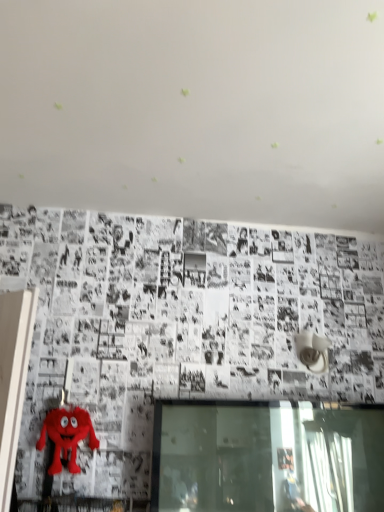
Question: Should I look upward or downward to see fuzzy red plush toy at lower left?

Choices:
 (A) down
 (B) up

Answer: (A)

Question: Does transparent glass window at lower center have a greater width compared to fuzzy red plush toy at lower left?

Choices:
 (A) yes
 (B) no

Answer: (A)

Question: From the image's perspective, is transparent glass window at lower center located beneath fuzzy red plush toy at lower left?

Choices:
 (A) no
 (B) yes

Answer: (B)

Question: Can you confirm if transparent glass window at lower center is shorter than fuzzy red plush toy at lower left?

Choices:
 (A) no
 (B) yes

Answer: (A)

Question: From the image's perspective, is transparent glass window at lower center located above fuzzy red plush toy at lower left?

Choices:
 (A) no
 (B) yes

Answer: (A)

Question: Could you tell me if transparent glass window at lower center is turned towards fuzzy red plush toy at lower left?

Choices:
 (A) yes
 (B) no

Answer: (B)

Question: Considering the relative sizes of transparent glass window at lower center and fuzzy red plush toy at lower left in the image provided, is transparent glass window at lower center taller than fuzzy red plush toy at lower left?

Choices:
 (A) no
 (B) yes

Answer: (B)

Question: Does fuzzy red plush toy at lower left have a lesser width compared to transparent glass window at lower center?

Choices:
 (A) yes
 (B) no

Answer: (A)

Question: From a real-world perspective, is fuzzy red plush toy at lower left physically above transparent glass window at lower center?

Choices:
 (A) yes
 (B) no

Answer: (A)

Question: Is fuzzy red plush toy at lower left next to transparent glass window at lower center and touching it?

Choices:
 (A) yes
 (B) no

Answer: (B)

Question: Is fuzzy red plush toy at lower left shorter than transparent glass window at lower center?

Choices:
 (A) no
 (B) yes

Answer: (B)

Question: Is fuzzy red plush toy at lower left closer to the viewer compared to transparent glass window at lower center?

Choices:
 (A) yes
 (B) no

Answer: (B)

Question: From a real-world perspective, does fuzzy red plush toy at lower left sit lower than transparent glass window at lower center?

Choices:
 (A) no
 (B) yes

Answer: (A)

Question: In the image, is transparent glass window at lower center on the left side or the right side of fuzzy red plush toy at lower left?

Choices:
 (A) right
 (B) left

Answer: (A)